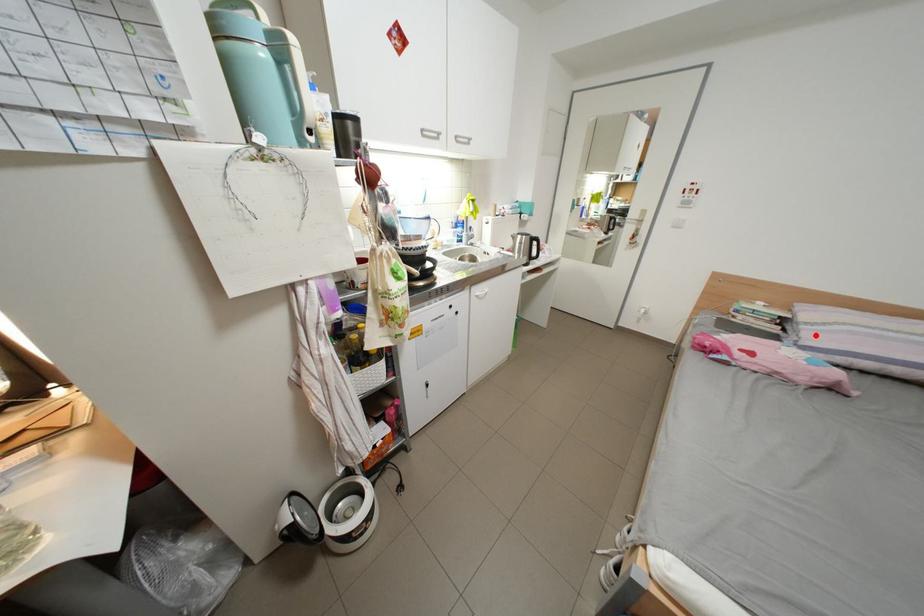
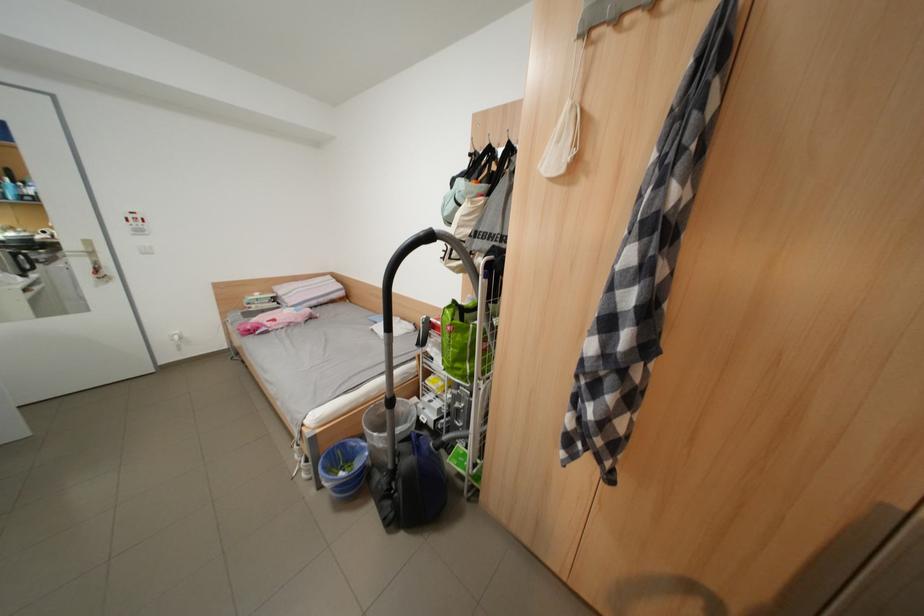
Question: I am providing you with two images of the same scene from different viewpoints. Given a red point in image1, look at the same physical point in image2. Is it:

Choices:
 (A) Closer to the viewpoint
 (B) Farther from the viewpoint

Answer: (A)